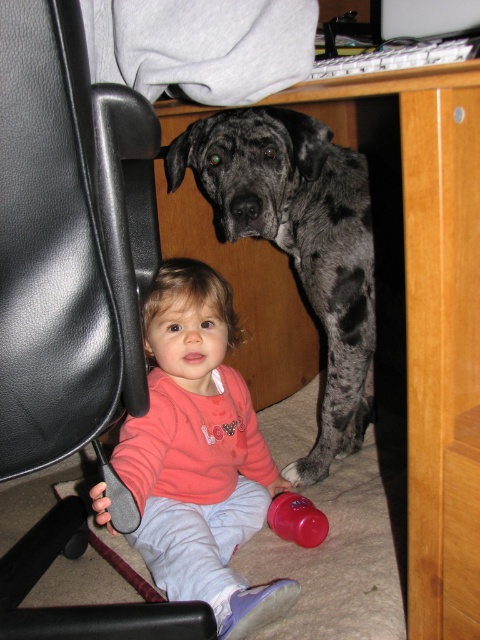
Question: Is black leather swivel chair at left above rubberized pink cup at lower center?

Choices:
 (A) yes
 (B) no

Answer: (A)

Question: Which point is closer to the camera?

Choices:
 (A) gray speckled fur at center
 (B) pink fleece sweater at lower left
 (C) rubberized pink cup at lower center

Answer: (B)

Question: Which point is farther to the camera?

Choices:
 (A) (285, 496)
 (B) (126, 284)
 (C) (348, 396)

Answer: (C)

Question: Can you confirm if black leather swivel chair at left is positioned below gray speckled fur at center?

Choices:
 (A) yes
 (B) no

Answer: (B)

Question: Does pink fleece sweater at lower left appear over gray speckled fur at center?

Choices:
 (A) no
 (B) yes

Answer: (A)

Question: Which is nearer to the pink fleece sweater at lower left?

Choices:
 (A) black leather swivel chair at left
 (B) gray speckled fur at center
 (C) wooden at center

Answer: (B)